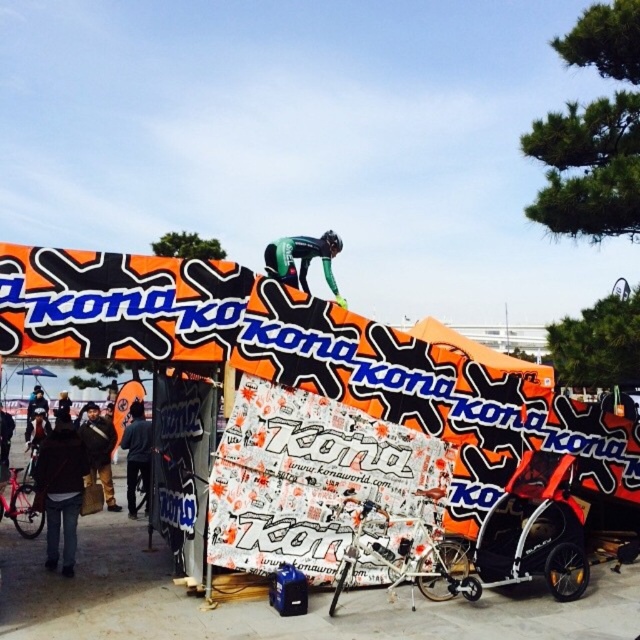
Measure the distance between dark brown leather jacket at lower left and dark gray jacket at center.

dark brown leather jacket at lower left and dark gray jacket at center are 7.47 feet apart.

Which is above, dark brown leather jacket at lower left or dark gray jacket at center?

Positioned higher is dark brown leather jacket at lower left.

Is point (84, 448) closer to camera compared to point (140, 477)?

Yes, it is in front of point (140, 477).

Identify the location of dark brown leather jacket at lower left. (60, 490).

Is point (52, 516) less distant than point (29, 406)?

Yes, it is in front of point (29, 406).

Is dark brown leather jacket at lower left below matte black bicycle at left?

Actually, dark brown leather jacket at lower left is above matte black bicycle at left.

Is point (76, 528) positioned in front of point (44, 406)?

Yes.

Identify the location of dark brown leather jacket at lower left. Image resolution: width=640 pixels, height=640 pixels. point(60,490).

Consider the image. Does dark brown leather jacket at lower left have a greater height compared to green fabric suit at center?

In fact, dark brown leather jacket at lower left may be shorter than green fabric suit at center.

Is dark brown leather jacket at lower left to the left of green fabric suit at center from the viewer's perspective?

Indeed, dark brown leather jacket at lower left is positioned on the left side of green fabric suit at center.

Is point (51, 456) more distant than point (337, 237)?

No, (51, 456) is in front of (337, 237).

Where is `dark brown leather jacket at lower left`? The width and height of the screenshot is (640, 640). dark brown leather jacket at lower left is located at coordinates (60, 490).